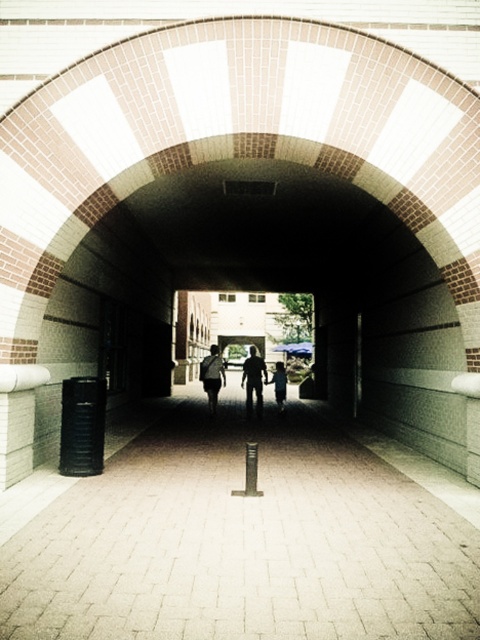
Looking at this image, between brick pavement at center and dark gray fabric jacket at center, which one appears on the left side from the viewer's perspective?

From the viewer's perspective, brick pavement at center appears more on the left side.

Is brick pavement at center taller than dark gray fabric jacket at center?

No.

The width and height of the screenshot is (480, 640). I want to click on brick pavement at center, so coord(240,536).

From the picture: Which is more to the left, dark gray fabric jacket at center or light blue denim jacket at center?

From the viewer's perspective, dark gray fabric jacket at center appears more on the left side.

Is dark gray fabric jacket at center taller than light blue denim jacket at center?

In fact, dark gray fabric jacket at center may be shorter than light blue denim jacket at center.

Between point (256, 385) and point (282, 387), which one is positioned behind?

The point (282, 387) is more distant.

Find the location of a particular element. The image size is (480, 640). dark gray fabric jacket at center is located at coordinates (253, 381).

Between brick pavement at center and matte black backpack at center, which one appears on the left side from the viewer's perspective?

matte black backpack at center is more to the left.

Locate an element on the screen. The height and width of the screenshot is (640, 480). brick pavement at center is located at coordinates (240, 536).

At what (x,y) coordinates should I click in order to perform the action: click on brick pavement at center. Please return your answer as a coordinate pair (x, y). The height and width of the screenshot is (640, 480). Looking at the image, I should click on (240, 536).